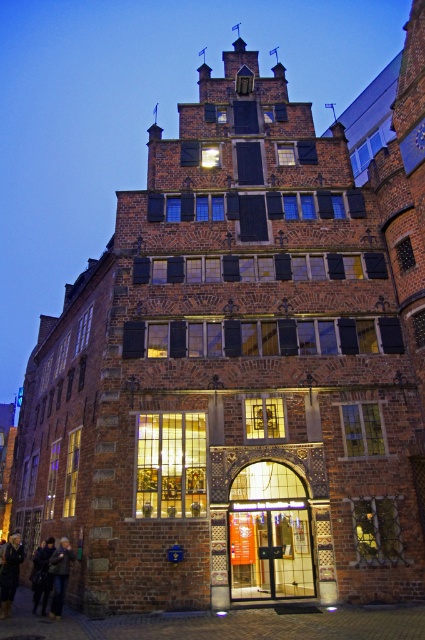
You are standing at the entrance of the historic brick building and notice the dark brown leather boots at lower left. If you want to place a small decorative flag exactly where the boots are currently located, what are the coordinates you should input into the placement tool?

The coordinates for the dark brown leather boots at lower left are at point (10, 572), so you should input those coordinates into the placement tool to place the flag there.

You are standing in front of the historic brick building at dusk and see the dark brown leather boots at lower left and the dark brown leather jacket at lower left. Which item is positioned closer to you?

The dark brown leather boots at lower left are closer to you than the dark brown leather jacket at lower left.